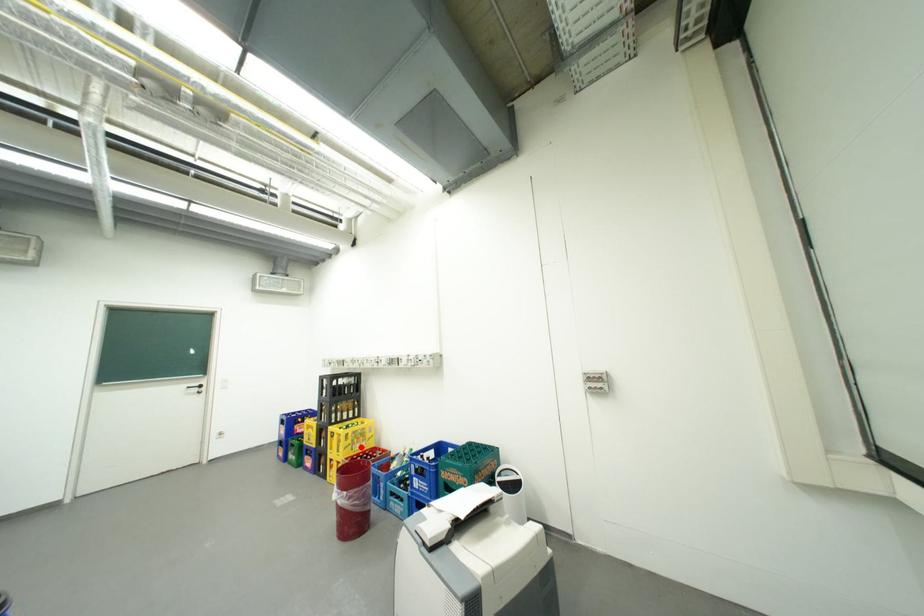
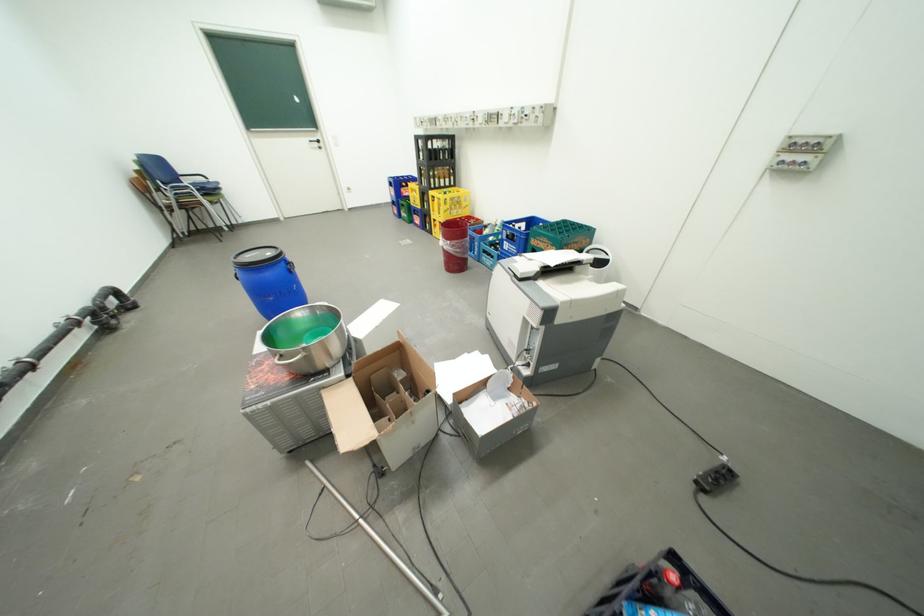
Question: I am providing you with two images of the same scene from different viewpoints. A red point is shown in image1. For the corresponding object point in image2, is it positioned nearer or farther from the camera?

Choices:
 (A) Nearer
 (B) Farther

Answer: (A)